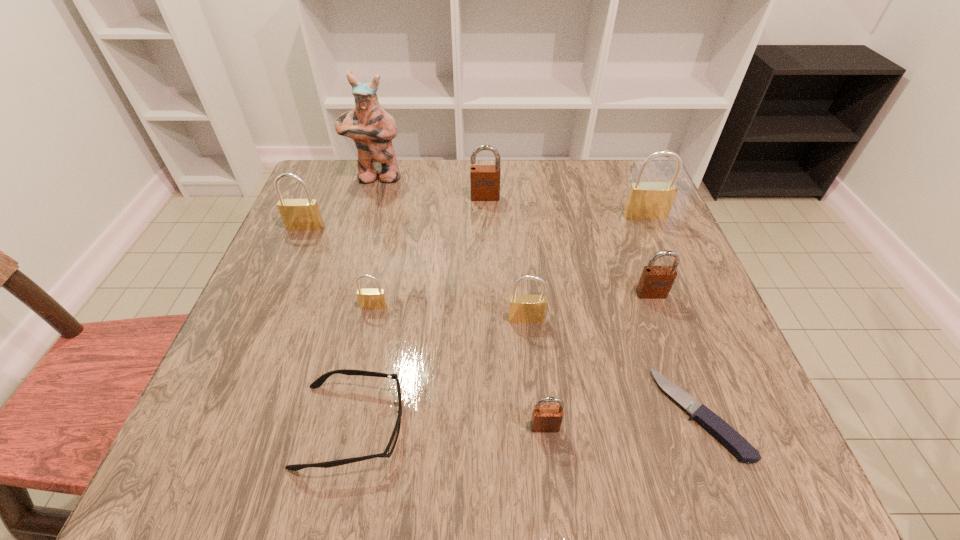
This screenshot has height=540, width=960. I want to click on free point located 0.380m on the front-facing side of the leftmost padlock, so click(245, 369).

Locate an element on the screen. Image resolution: width=960 pixels, height=540 pixels. free spot located 0.170m on the front-facing side of the third padlock from left to right is located at coordinates (486, 246).

Locate an element on the screen. This screenshot has height=540, width=960. free space located on the front-facing side of the fourth nearest padlock is located at coordinates (686, 392).

Locate an element on the screen. The image size is (960, 540). free space located 0.190m on the front-facing side of the second brass padlock from right to left is located at coordinates (535, 415).

Locate an element on the screen. The height and width of the screenshot is (540, 960). blank space located on the front-facing side of the smallest brass padlock is located at coordinates (342, 455).

Locate an element on the screen. This screenshot has width=960, height=540. vacant space situated 0.060m on the front-facing side of the nearest padlock is located at coordinates (550, 470).

You are a GUI agent. You are given a task and a screenshot of the screen. Output one action in this format:
    pyautogui.click(x=<x>, y=<y>)
    Task: Click on the vacant space located on the front-facing side of the second shortest object
    The image size is (960, 540).
    Given the screenshot: What is the action you would take?
    pyautogui.click(x=565, y=426)

Find the location of `vacant point located on the back of the shortest object`. vacant point located on the back of the shortest object is located at coordinates (664, 317).

Find the location of a particular element. Image resolution: width=960 pixels, height=540 pixels. figurine located at the far edge is located at coordinates (369, 125).

The image size is (960, 540). I want to click on padlock present at the near edge, so click(x=545, y=418).